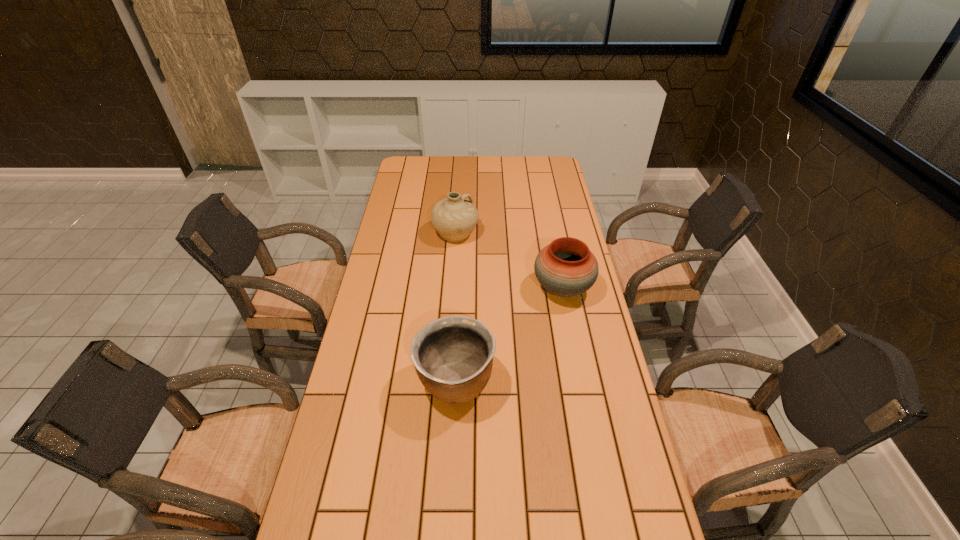
The height and width of the screenshot is (540, 960). I want to click on the farthest object, so click(454, 218).

I want to click on the rightmost object, so click(x=566, y=267).

Where is `the rightmost pottery`? the rightmost pottery is located at coordinates (566, 267).

Where is `the nearest pottery`? the nearest pottery is located at coordinates (453, 356).

You are a GUI agent. You are given a task and a screenshot of the screen. Output one action in this format:
    pyautogui.click(x=<x>, y=<y>)
    Task: Click on the free space located on the right of the farthest object
    This screenshot has height=540, width=960.
    Given the screenshot: What is the action you would take?
    pyautogui.click(x=525, y=233)

The width and height of the screenshot is (960, 540). Identify the location of vacant space positioned on the front of the rightmost pottery. (573, 344).

The width and height of the screenshot is (960, 540). In order to click on free space located on the back of the nearest object in this screenshot , I will do `click(460, 295)`.

Find the location of `object that is at the right edge`. object that is at the right edge is located at coordinates (566, 267).

In the image, there is a desktop. What are the coordinates of `vacant region at the far edge` in the screenshot? It's located at (504, 162).

Find the location of `vacant space at the left edge of the desktop`. vacant space at the left edge of the desktop is located at coordinates (396, 354).